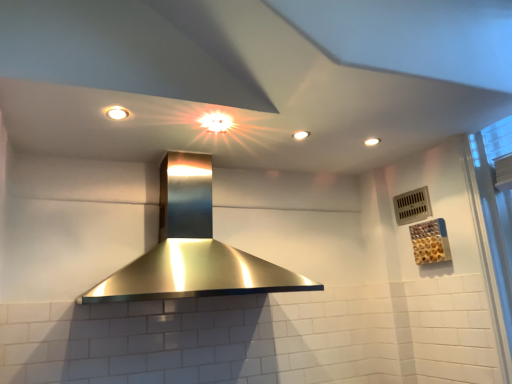
This screenshot has height=384, width=512. What do you see at coordinates (192, 248) in the screenshot?
I see `stainless steel vent at center` at bounding box center [192, 248].

What is the approximate width of stainless steel vent at center?

It is 66.10 centimeters.

Locate an element on the screen. stainless steel vent at center is located at coordinates (192, 248).

I want to click on stainless steel vent at center, so click(x=192, y=248).